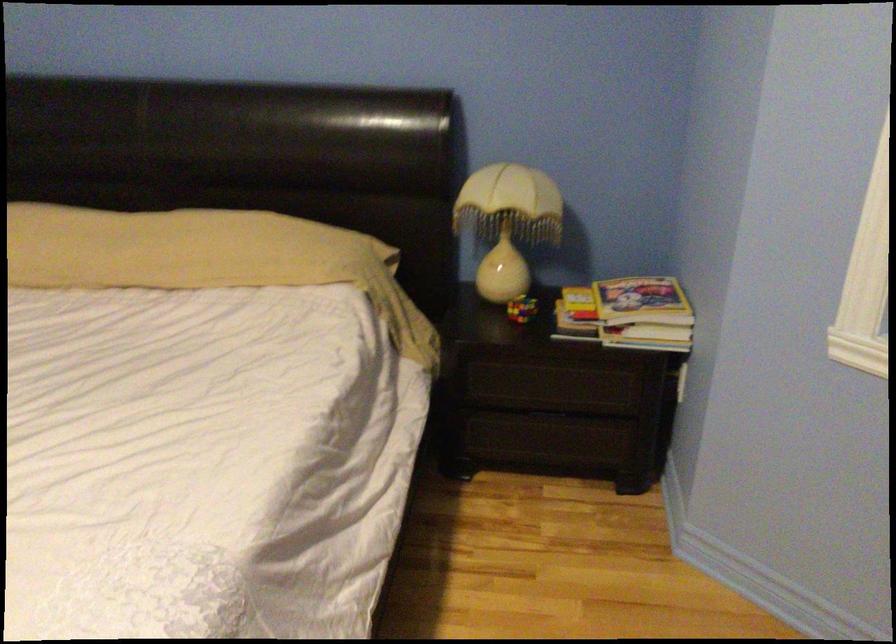
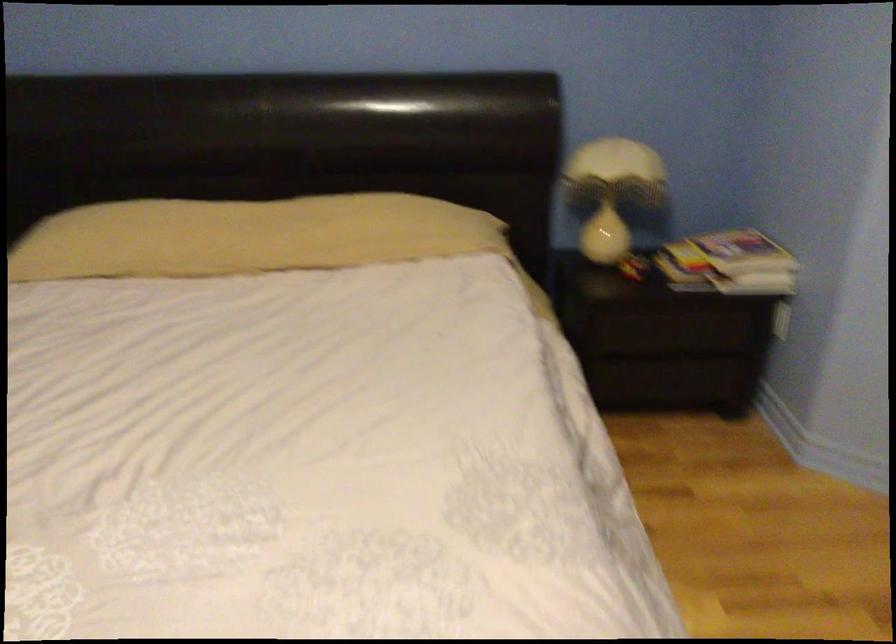
The point at (608, 323) is marked in the first image. Where is the corresponding point in the second image?

(728, 263)